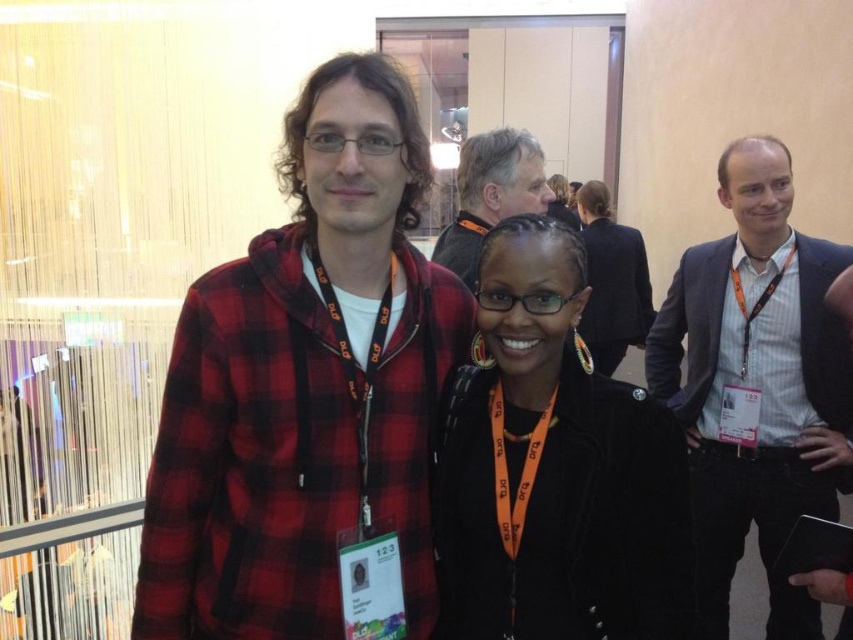
Question: Where is dark gray suit at right located in relation to light brown hair at upper center in the image?

Choices:
 (A) right
 (B) left

Answer: (A)

Question: Which of the following is the closest to the observer?

Choices:
 (A) light brown hair at upper center
 (B) black matte jacket at center
 (C) red plaid hoodie at center
 (D) black leather jacket at center

Answer: (C)

Question: Which object appears closest to the camera in this image?

Choices:
 (A) black matte jacket at center
 (B) light brown hair at upper center

Answer: (A)

Question: Which point is closer to the camera taking this photo?

Choices:
 (A) (489, 145)
 (B) (660, 566)

Answer: (B)

Question: Can you confirm if dark gray suit at right is wider than light brown hair at upper center?

Choices:
 (A) no
 (B) yes

Answer: (B)

Question: Is red plaid hoodie at center to the left of black matte jacket at center from the viewer's perspective?

Choices:
 (A) no
 (B) yes

Answer: (B)